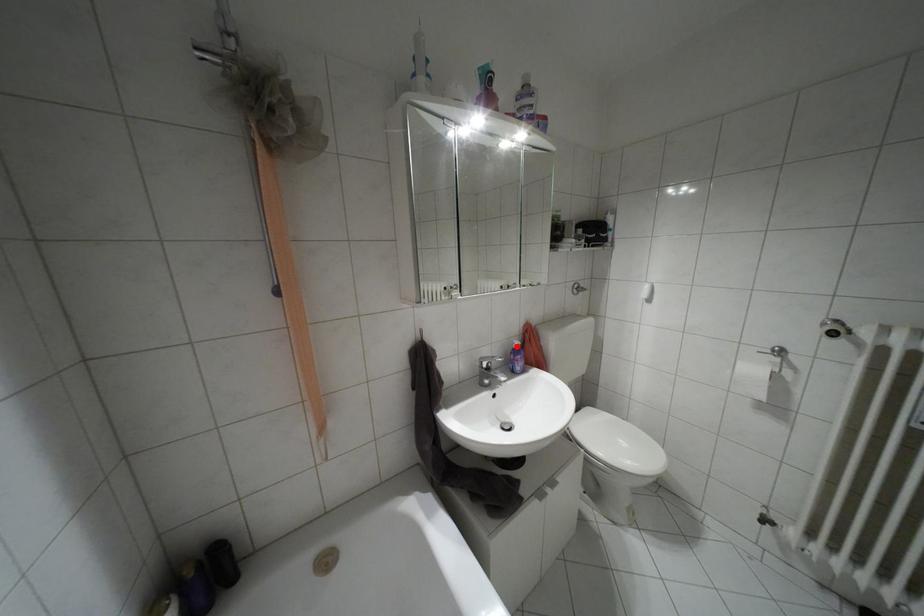
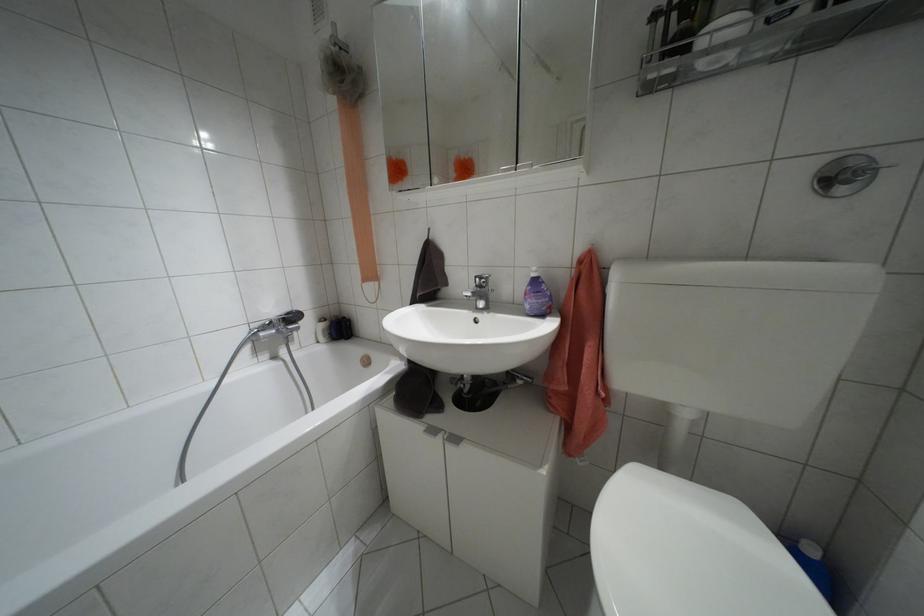
Where in the second image is the point corresponding to the highlighted location from the first image?

(532, 274)